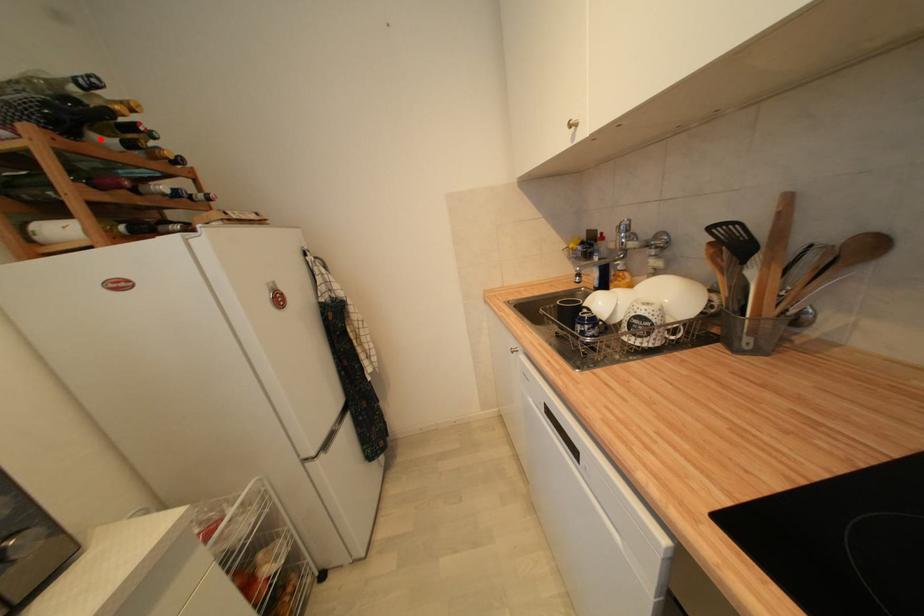
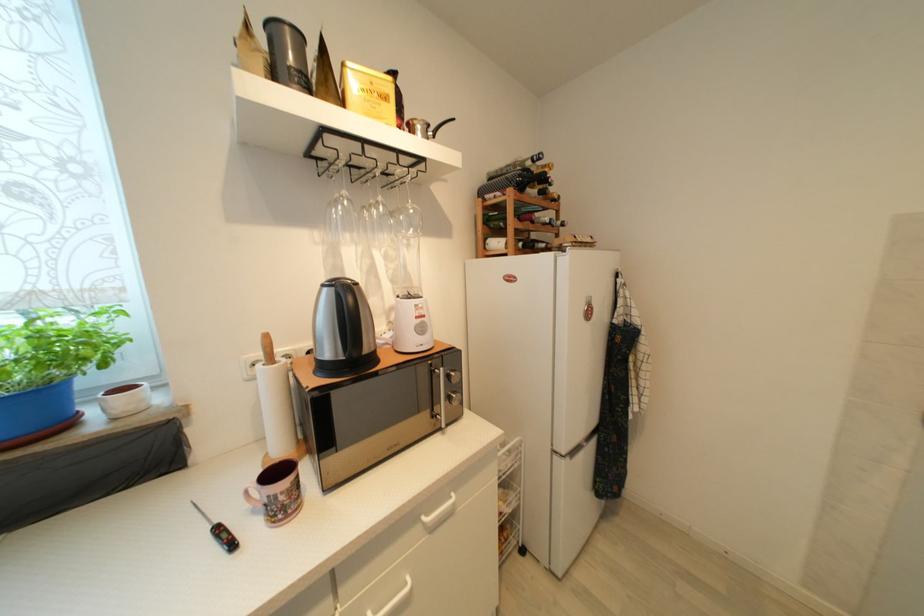
Find the pixel in the second image that matches the highlighted location in the first image.

(533, 192)